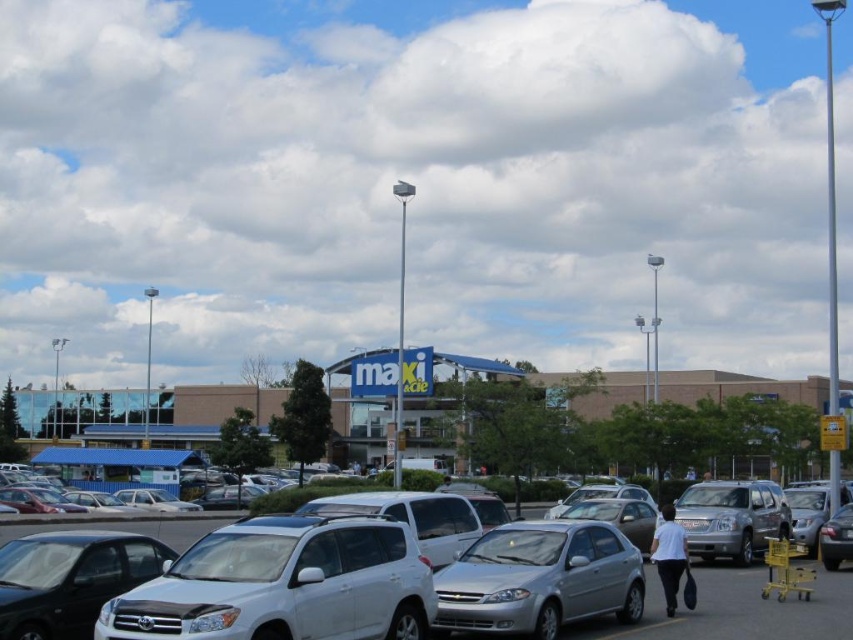
You are a delivery person who needs to place a large package on the ground between the silver metallic suv at center and the white cotton shirt at center. Which side of the two objects should you choose to ensure there is enough space for the package?

The white cotton shirt at center occupies more space than the silver metallic suv at center, so you should place the package on the side of the white cotton shirt at center to ensure there is enough space.

You are standing in the parking lot and want to go to the blue brick mall at center. Which direction should you walk relative to the silver metallic suv at center?

The blue brick mall at center is to the left of the silver metallic suv at center, so you should walk towards the left side of the silver metallic suv at center to reach the mall.

You are a delivery driver trying to park your truck in the parking lot. You see the blue brick mall at center and the silver metallic suv at center. Which object is closer to your truck?

The blue brick mall at center is further away than the silver metallic suv at center, so the silver metallic suv at center is closer to your truck.